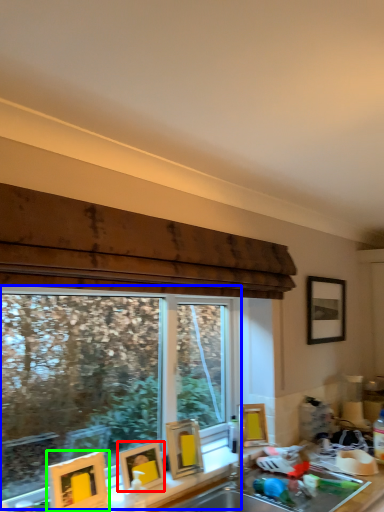
Question: Which is nearer to the picture frame (highlighted by a red box)? window (highlighted by a blue box) or picture frame (highlighted by a green box).

Choices:
 (A) window
 (B) picture frame

Answer: (B)